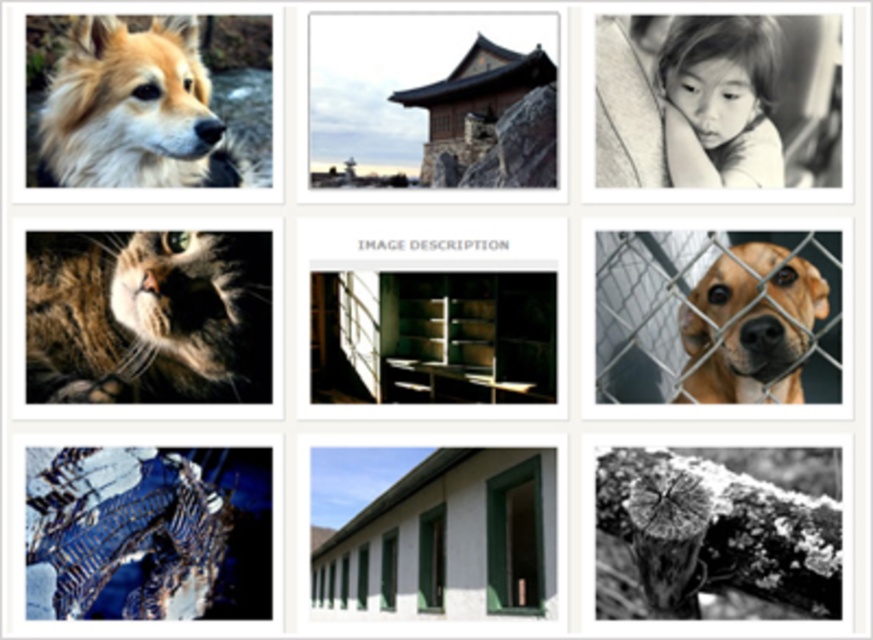
You are organizing a display in a store and need to place the tabby fur cat at upper left and the wooden shelves at center. According to the image, how are these two items arranged spatially?

The tabby fur cat at upper left is positioned over the wooden shelves at center, meaning it is placed above them in the arrangement.

Looking at the collage, you notice the wooden shelves at center and the fuzzy brown fur at upper left. Based on their positions, which object is located to the right of the other?

The wooden shelves at center are to the right of the fuzzy brown fur at upper left.

You are standing in front of the collage and want to take a closer look at the fuzzy brown fur at upper left. If your hand can reach up to 6 feet, can you touch it?

The fuzzy brown fur at upper left is 6.29 feet away from camera, so your hand can only reach up to 6 feet. Therefore, you cannot touch the fuzzy brown fur at upper left.